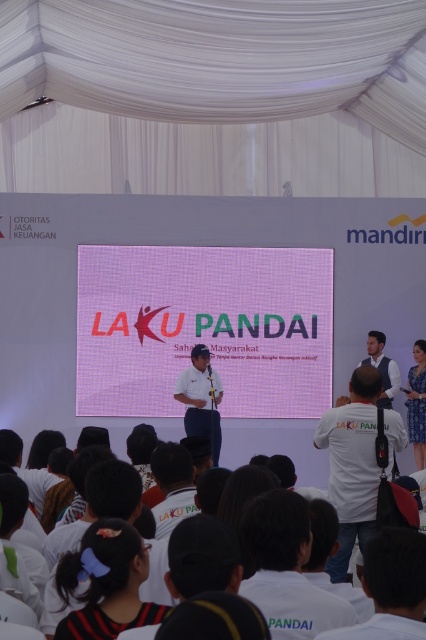
You are a photographer positioned at the front of the stage. You need to capture a photo where both the pink grid projection screen at center and the white matte shirt at center are in focus. The camera you are using has a depth of field that can sharply focus on objects within 5 meters of each other. Can you achieve this with your current setup?

The pink grid projection screen at center is 6.24 meters away from the white matte shirt at center. Since the distance between them exceeds the camera s 5 meter depth of field range, it would be challenging to have both in focus simultaneously with the current setup.